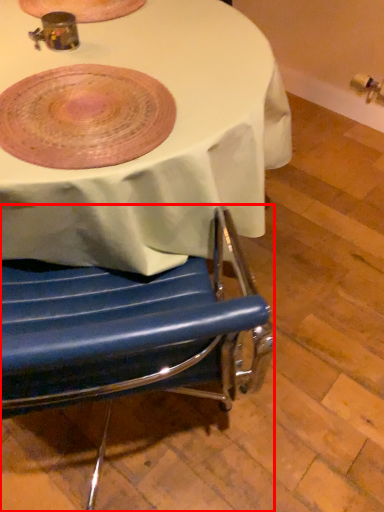
Question: Where is chair (annotated by the red box) located in relation to platter in the image?

Choices:
 (A) right
 (B) left

Answer: (A)